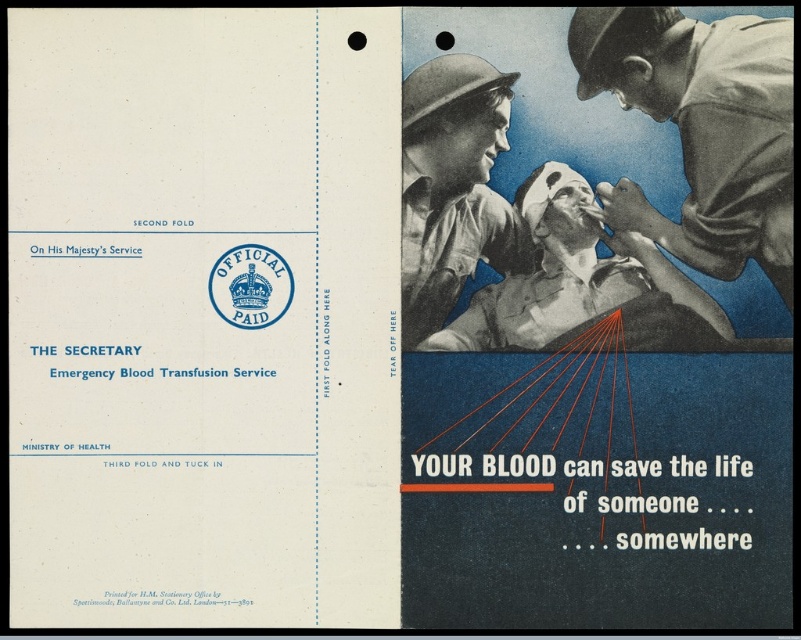
Question: Can you confirm if blue uniform shirt at upper right is bigger than matte gray uniform at center?

Choices:
 (A) no
 (B) yes

Answer: (B)

Question: Estimate the real-world distances between objects in this image. Which object is farther from the matte khaki uniform at center?

Choices:
 (A) blue uniform shirt at upper right
 (B) matte gray uniform at center

Answer: (A)

Question: Which object appears closest to the camera in this image?

Choices:
 (A) matte khaki uniform at center
 (B) blue uniform shirt at upper right
 (C) matte gray uniform at center

Answer: (B)

Question: Among these objects, which one is nearest to the camera?

Choices:
 (A) matte gray uniform at center
 (B) matte khaki uniform at center
 (C) blue uniform shirt at upper right

Answer: (C)

Question: Where is blue uniform shirt at upper right located in relation to matte gray uniform at center in the image?

Choices:
 (A) above
 (B) below

Answer: (A)

Question: Can you confirm if blue uniform shirt at upper right is smaller than matte khaki uniform at center?

Choices:
 (A) yes
 (B) no

Answer: (B)